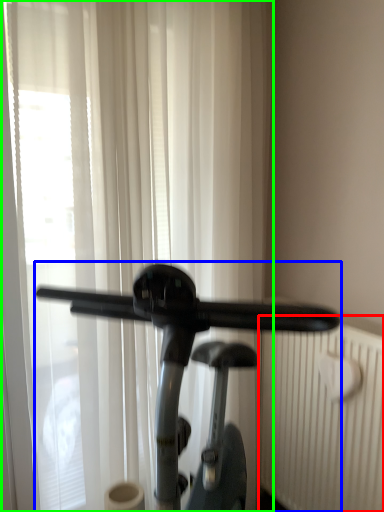
Question: Considering the real-world distances, which object is closest to radiator (highlighted by a red box)? stationary bicycle (highlighted by a blue box) or curtain (highlighted by a green box).

Choices:
 (A) stationary bicycle
 (B) curtain

Answer: (A)